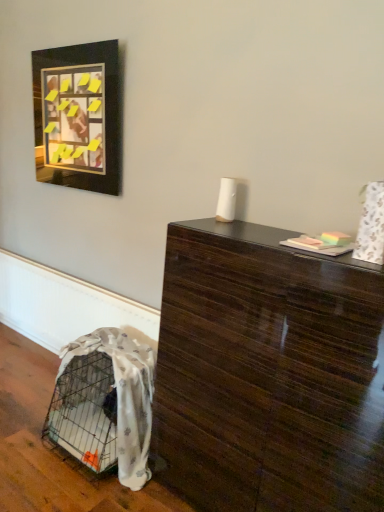
Question: Can you confirm if glossy dark wood table at center is shorter than white textured blanket at lower left?

Choices:
 (A) no
 (B) yes

Answer: (A)

Question: Considering the relative sizes of glossy dark wood table at center and white textured blanket at lower left in the image provided, is glossy dark wood table at center smaller than white textured blanket at lower left?

Choices:
 (A) yes
 (B) no

Answer: (B)

Question: Is glossy dark wood table at center behind white textured blanket at lower left?

Choices:
 (A) no
 (B) yes

Answer: (A)

Question: From the image's perspective, is glossy dark wood table at center on white textured blanket at lower left?

Choices:
 (A) no
 (B) yes

Answer: (B)

Question: Is glossy dark wood table at center oriented towards white textured blanket at lower left?

Choices:
 (A) no
 (B) yes

Answer: (A)

Question: Can you confirm if glossy dark wood table at center is thinner than white textured blanket at lower left?

Choices:
 (A) no
 (B) yes

Answer: (B)

Question: Does white textured blanket at lower left contain glossy dark wood table at center?

Choices:
 (A) no
 (B) yes

Answer: (A)

Question: Are white textured blanket at lower left and glossy dark wood table at center far apart?

Choices:
 (A) no
 (B) yes

Answer: (A)

Question: Can you confirm if white textured blanket at lower left is bigger than glossy dark wood table at center?

Choices:
 (A) yes
 (B) no

Answer: (B)

Question: Considering the relative sizes of white textured blanket at lower left and glossy dark wood table at center in the image provided, is white textured blanket at lower left taller than glossy dark wood table at center?

Choices:
 (A) yes
 (B) no

Answer: (B)

Question: Does white textured blanket at lower left have a lesser width compared to glossy dark wood table at center?

Choices:
 (A) yes
 (B) no

Answer: (B)

Question: From the image's perspective, does white textured blanket at lower left appear higher than glossy dark wood table at center?

Choices:
 (A) no
 (B) yes

Answer: (A)

Question: Is white textured blanket at lower left positioned far away from black matte picture frame at upper left?

Choices:
 (A) yes
 (B) no

Answer: (A)